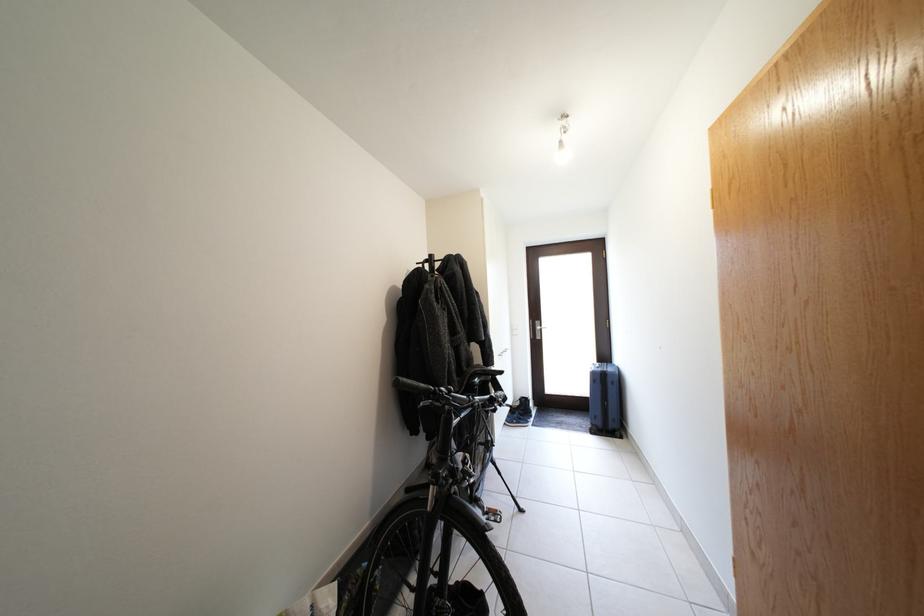
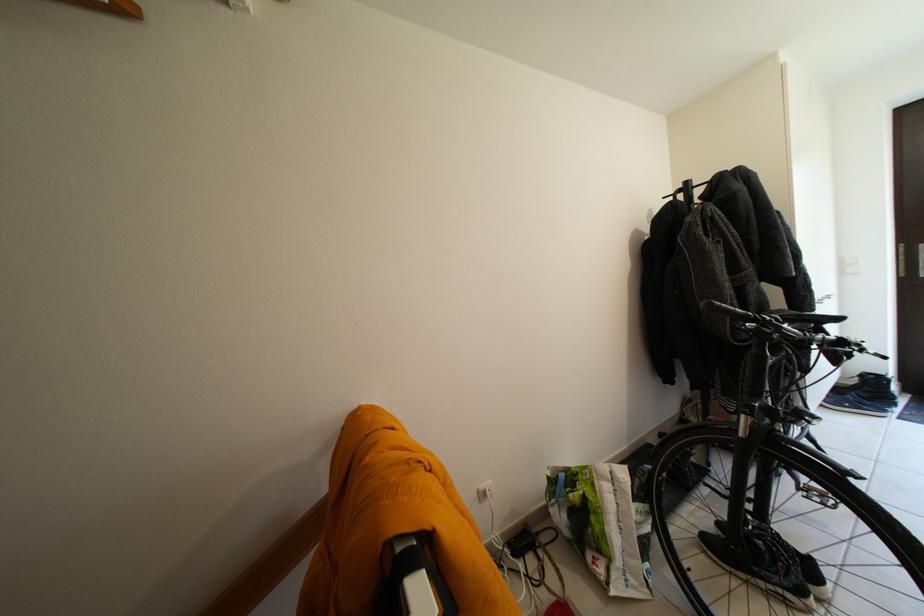
In the second image, find the point that corresponds to [440,261] in the first image.

(696, 188)